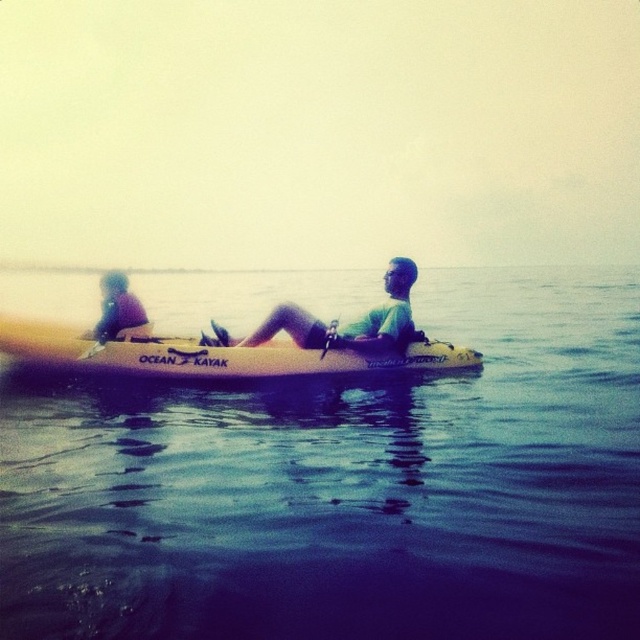
Question: Which object is farther from the camera taking this photo?

Choices:
 (A) green matte kayak at center
 (B) yellow foam paddle at center
 (C) yellow matte kayak at center

Answer: (A)

Question: Does green matte kayak at center appear on the right side of yellow foam paddle at center?

Choices:
 (A) no
 (B) yes

Answer: (B)

Question: Which of these objects is positioned closest to the blue water at center?

Choices:
 (A) yellow foam paddle at center
 (B) yellow matte kayak at center
 (C) green matte kayak at center

Answer: (C)

Question: Can you confirm if blue water at center is thinner than green matte kayak at center?

Choices:
 (A) yes
 (B) no

Answer: (B)

Question: Among these objects, which one is nearest to the camera?

Choices:
 (A) yellow matte kayak at center
 (B) blue water at center
 (C) yellow foam paddle at center

Answer: (B)

Question: Does blue water at center have a larger size compared to yellow matte kayak at center?

Choices:
 (A) yes
 (B) no

Answer: (A)